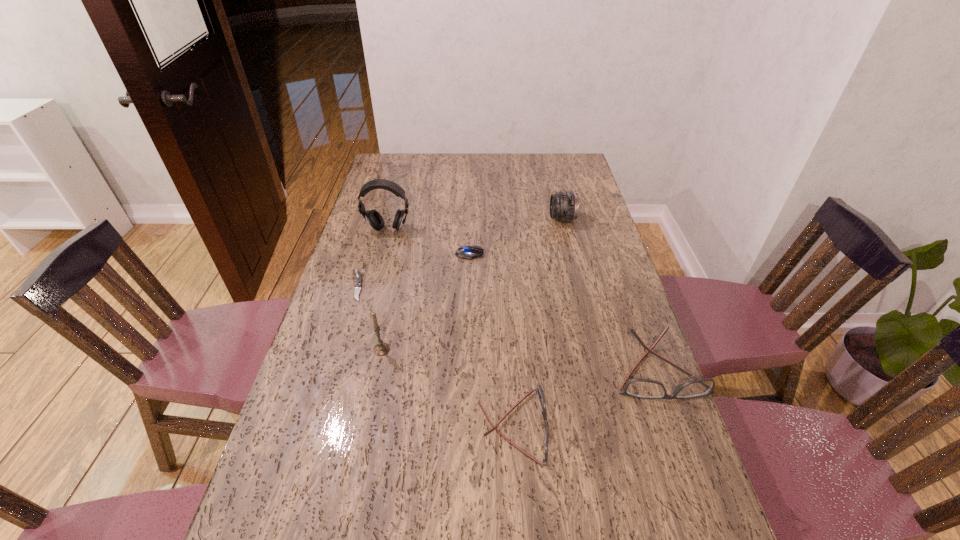
This screenshot has height=540, width=960. I want to click on object that stands as the sixth closest to the pocketknife, so pyautogui.click(x=639, y=388).

Point out which object is positioned as the third nearest to the third farthest object. Please provide its 2D coordinates. Your answer should be formatted as a tuple, i.e. [(x, y)], where the tuple contains the x and y coordinates of a point satisfying the conditions above.

[(358, 278)]

The height and width of the screenshot is (540, 960). Identify the location of vacant area in the image that satisfies the following two spatial constraints: 1. on the ear cups of the candle; 2. on the right side of the earphone. (356, 349).

Identify the location of vacant space that satisfies the following two spatial constraints: 1. on the ear cups of the candle; 2. on the right side of the earphone. Image resolution: width=960 pixels, height=540 pixels. (356, 349).